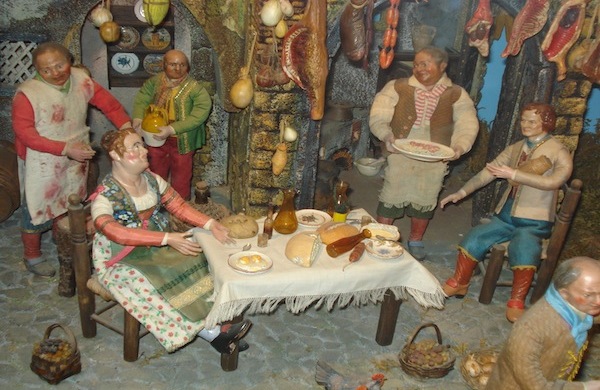
Where is `figurines of people`? Image resolution: width=600 pixels, height=390 pixels. figurines of people is located at coordinates (66, 127), (172, 107), (127, 193), (411, 111), (533, 156), (553, 331).